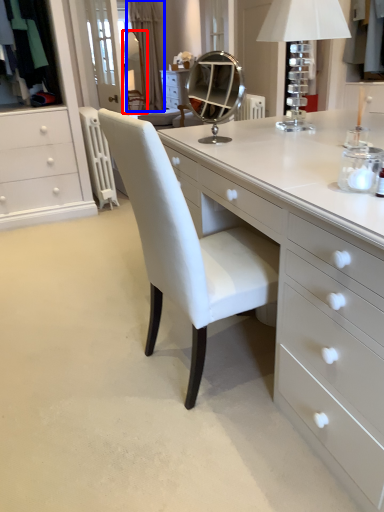
Question: Among these objects, which one is farthest to the camera, mirror (highlighted by a red box) or curtain (highlighted by a blue box)?

Choices:
 (A) mirror
 (B) curtain

Answer: (B)